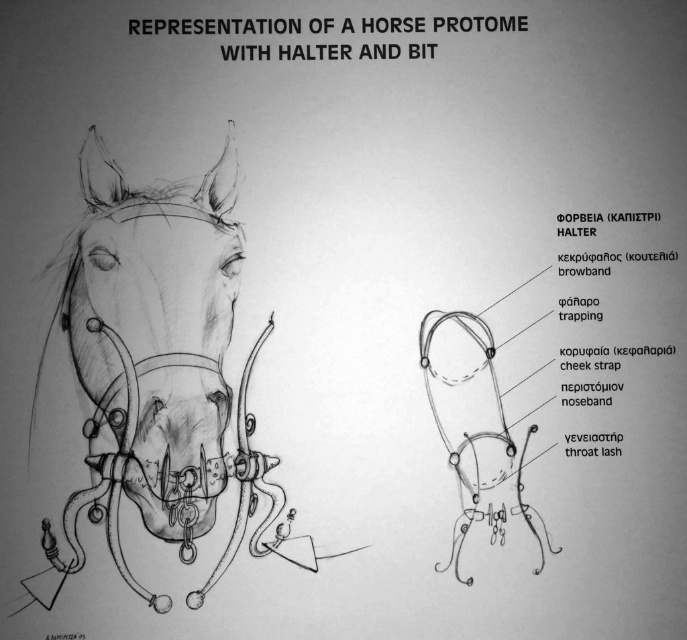
You are an artist examining the horse protome illustration. You notice two points marked on the halter and bit. Which of the two points, point (131, 496) or point (155, 483), appears closer to you in the illustration?

Point (131, 496) is closer to the viewer than point (155, 483).

You are standing in front of the image of the horse head. There is a point marked at coordinates point [179,195]. If you want to touch this point with a 6.5 feet long stick, can you reach it?

The point [179,195] is 6.44 feet from the camera, so yes, the 6.5 feet long stick can reach it since it is slightly longer than the distance.

You are an artist examining the horse head sculpture. You notice the matte black horse head at center and the matte black muzzle at center. Which object is positioned closer to your viewpoint?

The matte black horse head at center is closer to the viewer than the matte black muzzle at center.